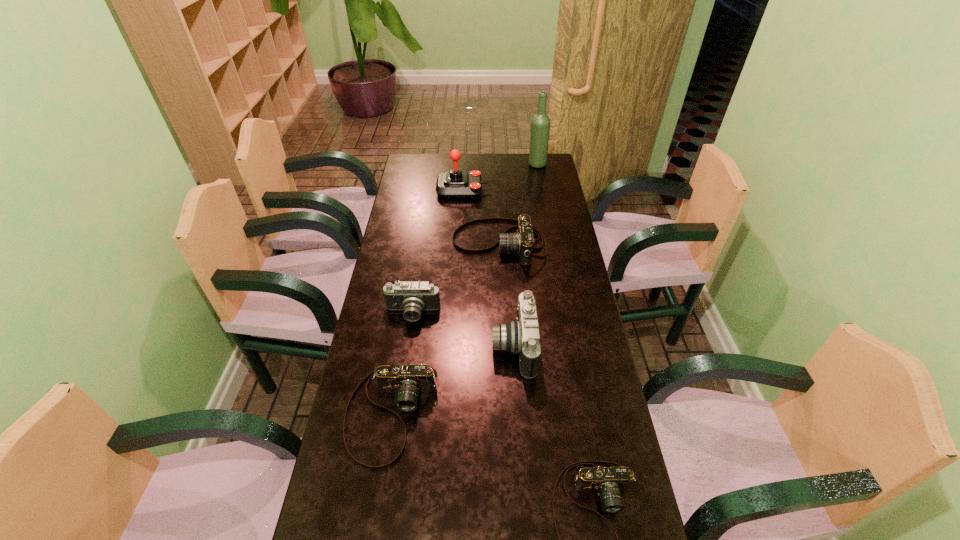
In order to click on free location located 0.120m on the front-facing side of the leftmost brown camera in this screenshot , I will do `click(374, 522)`.

This screenshot has width=960, height=540. Find the location of `object located at the far edge`. object located at the far edge is located at coordinates (540, 124).

I want to click on wine bottle that is at the right edge, so click(x=540, y=124).

Identify the location of camera that is at the right edge. The width and height of the screenshot is (960, 540). (522, 241).

You are a GUI agent. You are given a task and a screenshot of the screen. Output one action in this format:
    pyautogui.click(x=<x>, y=<y>)
    Task: Click on the object located at the far right corner
    This screenshot has width=960, height=540.
    Given the screenshot: What is the action you would take?
    pyautogui.click(x=540, y=124)

Where is `vacant point at the far edge`? This screenshot has width=960, height=540. vacant point at the far edge is located at coordinates (446, 157).

In the image, there is a desktop. Where is `vacant region at the left edge`? This screenshot has height=540, width=960. vacant region at the left edge is located at coordinates (418, 222).

In the image, there is a desktop. What are the coordinates of `vacant region at the right edge` in the screenshot? It's located at (559, 202).

In the image, there is a desktop. Where is `vacant space at the far left corner`? vacant space at the far left corner is located at coordinates (434, 168).

At what (x,y) coordinates should I click in order to perform the action: click on vacant point located between the second shortest camera and the third farthest object. Please return your answer as a coordinate pair (x, y). The width and height of the screenshot is (960, 540). Looking at the image, I should click on (445, 328).